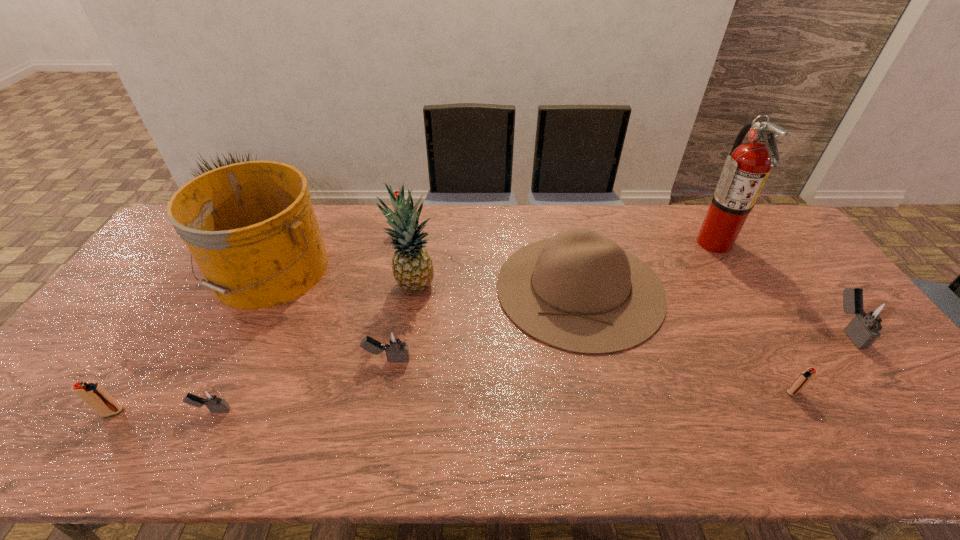
Where is `the tallest object`? This screenshot has width=960, height=540. the tallest object is located at coordinates (746, 169).

Find the location of a particular element. The width and height of the screenshot is (960, 540). red fire extinguisher is located at coordinates (746, 169).

What are the coordinates of `the second tallest object` in the screenshot? It's located at (412, 267).

Locate an element on the screen. The height and width of the screenshot is (540, 960). yellow pineapple is located at coordinates (412, 267).

Locate an element on the screen. The height and width of the screenshot is (540, 960). yellow bucket is located at coordinates (251, 228).

This screenshot has height=540, width=960. I want to click on bucket, so click(x=251, y=228).

This screenshot has width=960, height=540. Find the location of `the fourth tallest object`. the fourth tallest object is located at coordinates (579, 291).

Identify the location of sombrero. (579, 291).

Locate an element on the screen. Image resolution: width=960 pixels, height=540 pixels. the biggest red igniter is located at coordinates (396, 193).

Where is `the farthest red igniter`? This screenshot has height=540, width=960. the farthest red igniter is located at coordinates (396, 193).